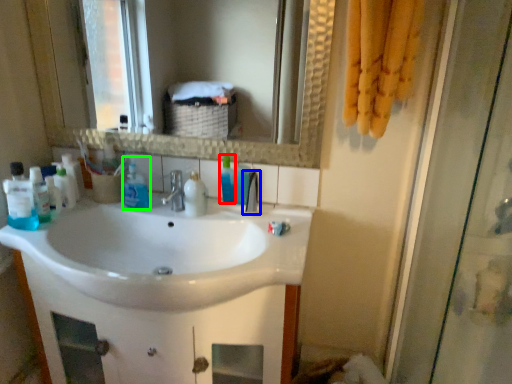
Question: Which object is positioned farthest from cleaning product (highlighted by a red box)? Select from tap (highlighted by a blue box) and cleaning product (highlighted by a green box).

Choices:
 (A) tap
 (B) cleaning product

Answer: (B)